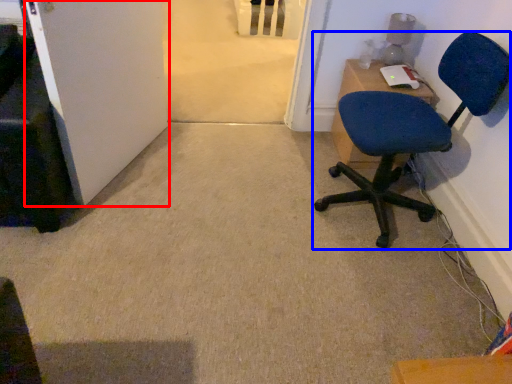
Question: Which object is closer to the camera taking this photo, door (highlighted by a red box) or chair (highlighted by a blue box)?

Choices:
 (A) door
 (B) chair

Answer: (A)